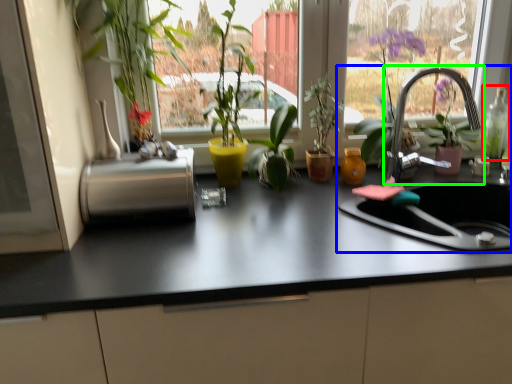
Question: Considering the real-world distances, which object is closest to bottle (highlighted by a red box)? sink (highlighted by a blue box) or tap (highlighted by a green box).

Choices:
 (A) sink
 (B) tap

Answer: (B)